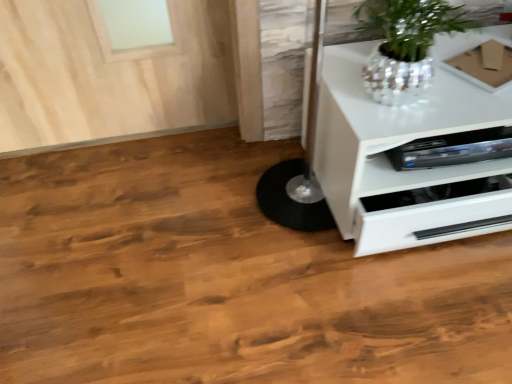
Question: From the image's perspective, does brown cardboard box at upper right appear lower than shiny metallic pot at upper right?

Choices:
 (A) yes
 (B) no

Answer: (B)

Question: Considering the relative positions of brown cardboard box at upper right and shiny metallic pot at upper right in the image provided, is brown cardboard box at upper right in front of shiny metallic pot at upper right?

Choices:
 (A) no
 (B) yes

Answer: (A)

Question: Considering the relative sizes of brown cardboard box at upper right and shiny metallic pot at upper right in the image provided, is brown cardboard box at upper right thinner than shiny metallic pot at upper right?

Choices:
 (A) yes
 (B) no

Answer: (A)

Question: From the image's perspective, is brown cardboard box at upper right above shiny metallic pot at upper right?

Choices:
 (A) yes
 (B) no

Answer: (A)

Question: Does brown cardboard box at upper right have a lesser height compared to shiny metallic pot at upper right?

Choices:
 (A) no
 (B) yes

Answer: (B)

Question: Is shiny metallic pot at upper right at the back of brown cardboard box at upper right?

Choices:
 (A) no
 (B) yes

Answer: (A)

Question: Is brown cardboard box at upper right located within shiny metallic pot at upper right?

Choices:
 (A) yes
 (B) no

Answer: (B)

Question: From the image's perspective, is shiny metallic pot at upper right under brown cardboard box at upper right?

Choices:
 (A) yes
 (B) no

Answer: (A)

Question: Is shiny metallic pot at upper right beside brown cardboard box at upper right?

Choices:
 (A) yes
 (B) no

Answer: (B)

Question: Is shiny metallic pot at upper right facing away from brown cardboard box at upper right?

Choices:
 (A) yes
 (B) no

Answer: (B)

Question: Can you confirm if shiny metallic pot at upper right is shorter than brown cardboard box at upper right?

Choices:
 (A) no
 (B) yes

Answer: (A)

Question: Considering the relative positions of shiny metallic pot at upper right and brown cardboard box at upper right in the image provided, is shiny metallic pot at upper right to the right of brown cardboard box at upper right from the viewer's perspective?

Choices:
 (A) yes
 (B) no

Answer: (B)

Question: Considering the relative sizes of white glossy chest of drawers at lower right and brown cardboard box at upper right in the image provided, is white glossy chest of drawers at lower right bigger than brown cardboard box at upper right?

Choices:
 (A) yes
 (B) no

Answer: (A)